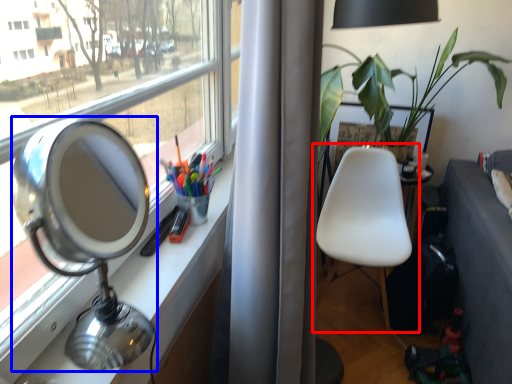
Question: Which of the following is the farthest to the observer, chair (highlighted by a red box) or table lamp (highlighted by a blue box)?

Choices:
 (A) chair
 (B) table lamp

Answer: (A)